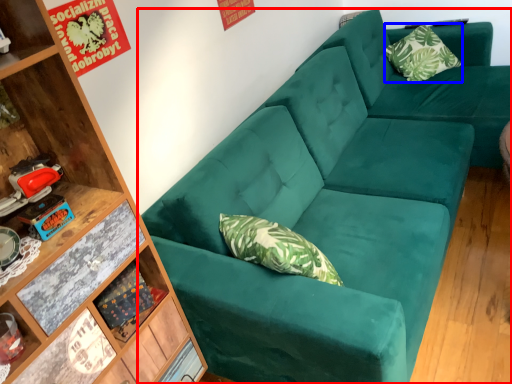
Question: Which point is further to the camera, studio couch (highlighted by a red box) or pillow (highlighted by a blue box)?

Choices:
 (A) studio couch
 (B) pillow

Answer: (B)